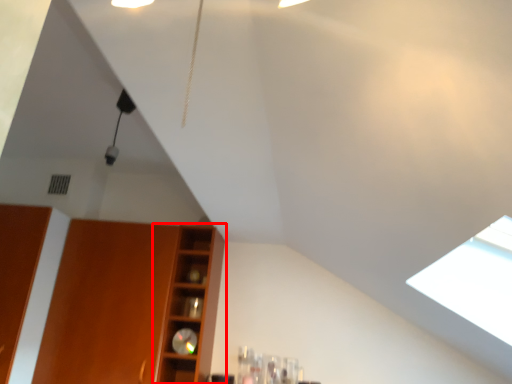
Question: From the image, what is the correct spatial relationship of shelf (annotated by the red box) in relation to cabinetry?

Choices:
 (A) right
 (B) left

Answer: (A)